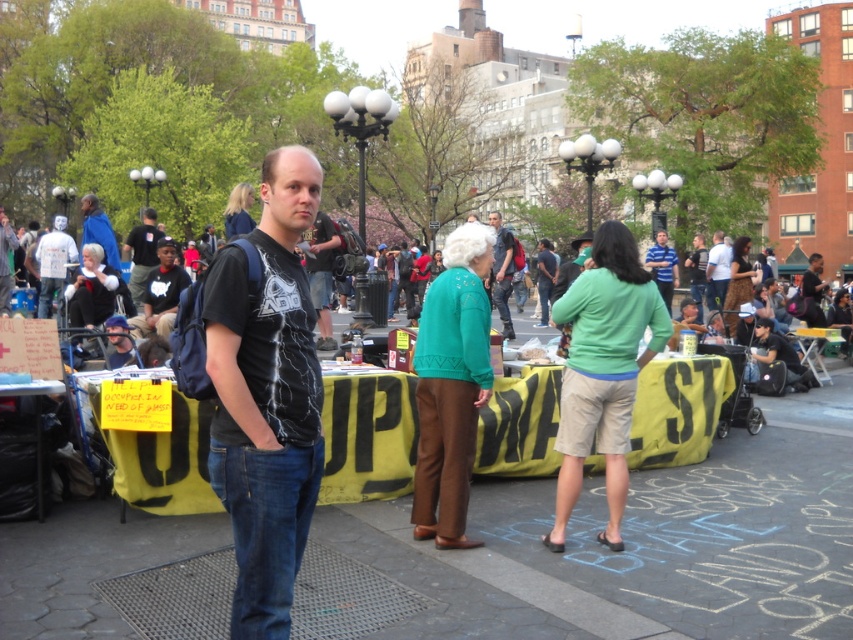
Can you confirm if black matte t-shirt at center is bigger than matte black backpack at center?

Yes, black matte t-shirt at center is bigger than matte black backpack at center.

Locate an element on the screen. The width and height of the screenshot is (853, 640). black matte t-shirt at center is located at coordinates (265, 396).

From the picture: Between matte black backpack at center and white cotton shirt at upper right, which one is positioned lower?

matte black backpack at center is below.

Can you confirm if matte black backpack at center is positioned below white cotton shirt at upper right?

Correct, matte black backpack at center is located below white cotton shirt at upper right.

Which is behind, point (498, 253) or point (711, 300)?

Positioned behind is point (711, 300).

Image resolution: width=853 pixels, height=640 pixels. I want to click on matte black backpack at center, so click(x=502, y=272).

Between black matte t-shirt at center and dark blue backpack at center, which one has less height?

dark blue backpack at center is shorter.

How distant is black matte t-shirt at center from dark blue backpack at center?

black matte t-shirt at center is 12.04 meters away from dark blue backpack at center.

Does point (283, 362) come farther from viewer compared to point (134, 300)?

No, it is in front of (134, 300).

This screenshot has height=640, width=853. Identify the location of black matte t-shirt at center. (265, 396).